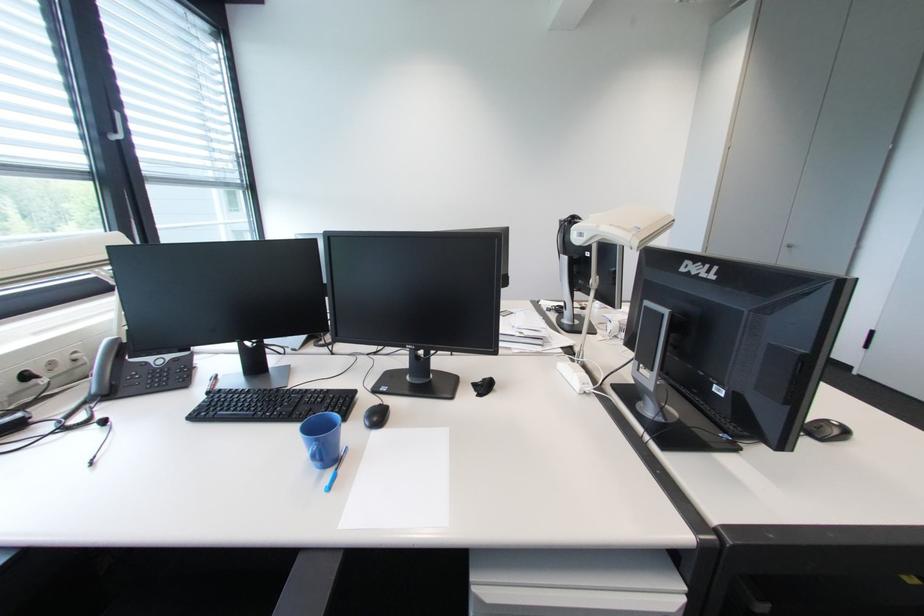
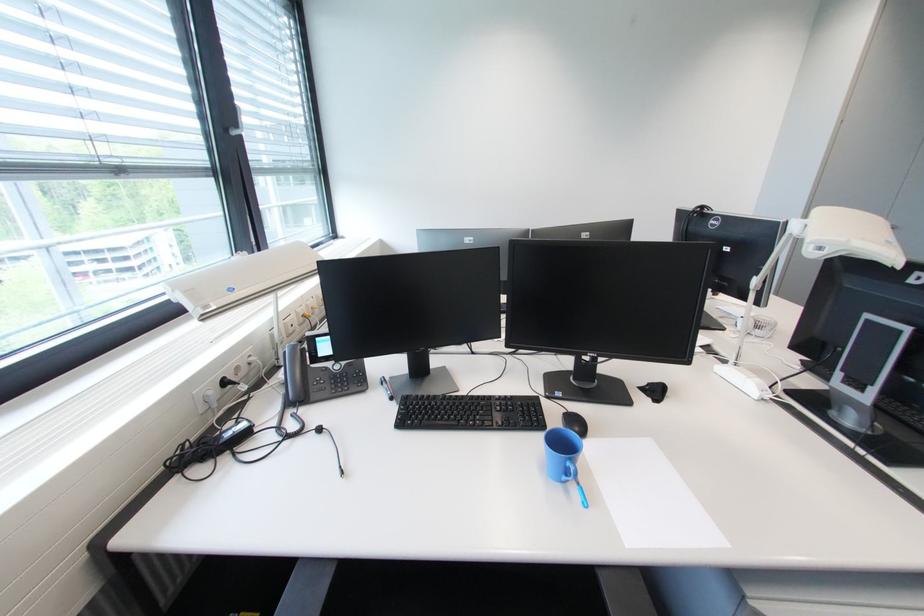
In the second image, find the point that corresponds to point (490, 381) in the first image.

(655, 386)